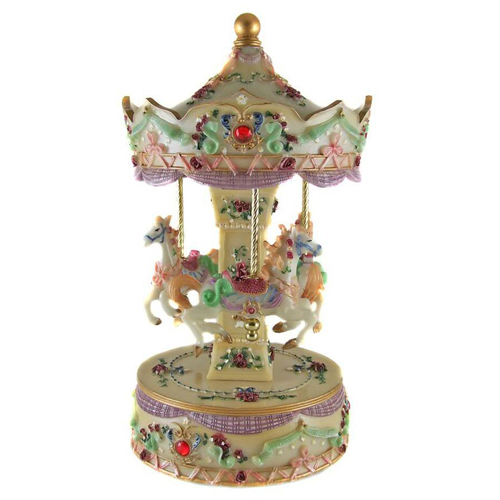
The height and width of the screenshot is (500, 500). I want to click on center column, so click(x=239, y=241).